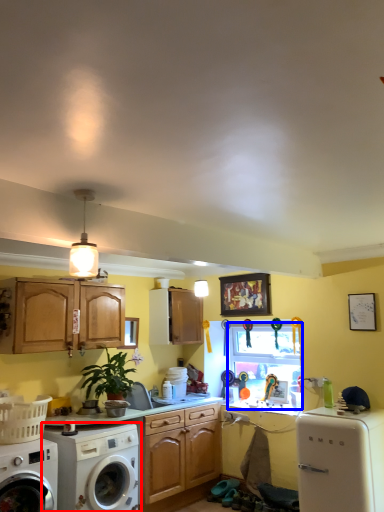
Question: Which of the following is the closest to the observer, washing machine (highlighted by a red box) or window screen (highlighted by a blue box)?

Choices:
 (A) washing machine
 (B) window screen

Answer: (A)